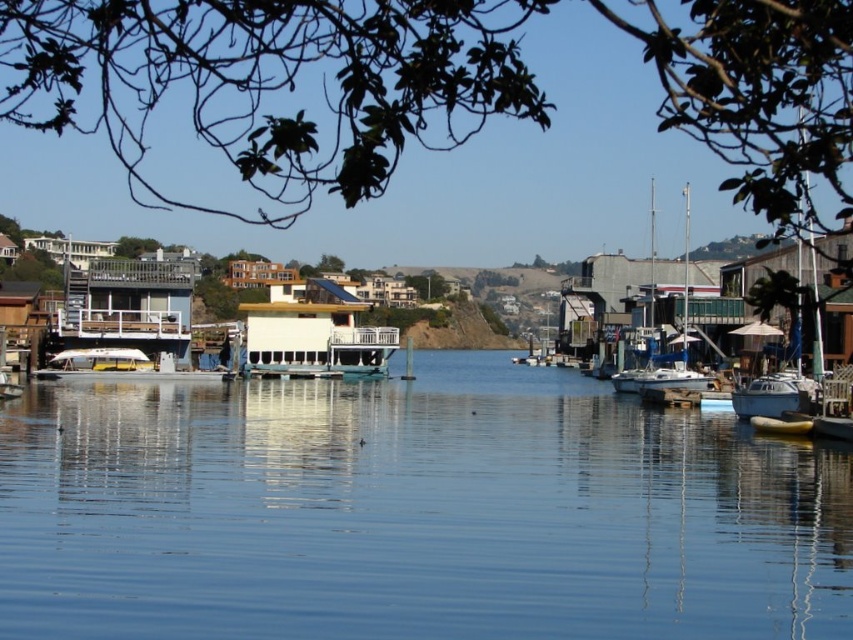
Measure the distance between clear blue water at center and white matte sailboat at center-right.

172.12 feet

At what (x,y) coordinates should I click in order to perform the action: click on clear blue water at center. Please return your answer as a coordinate pair (x, y). The height and width of the screenshot is (640, 853). Looking at the image, I should click on (x=412, y=513).

Can you confirm if clear blue water at center is taller than white glossy boat at left?

Correct, clear blue water at center is much taller as white glossy boat at left.

Where is `clear blue water at center`? This screenshot has height=640, width=853. clear blue water at center is located at coordinates (412, 513).

This screenshot has width=853, height=640. In order to click on clear blue water at center in this screenshot , I will do `click(412, 513)`.

The image size is (853, 640). Find the location of `white glossy boat at left`. white glossy boat at left is located at coordinates (100, 360).